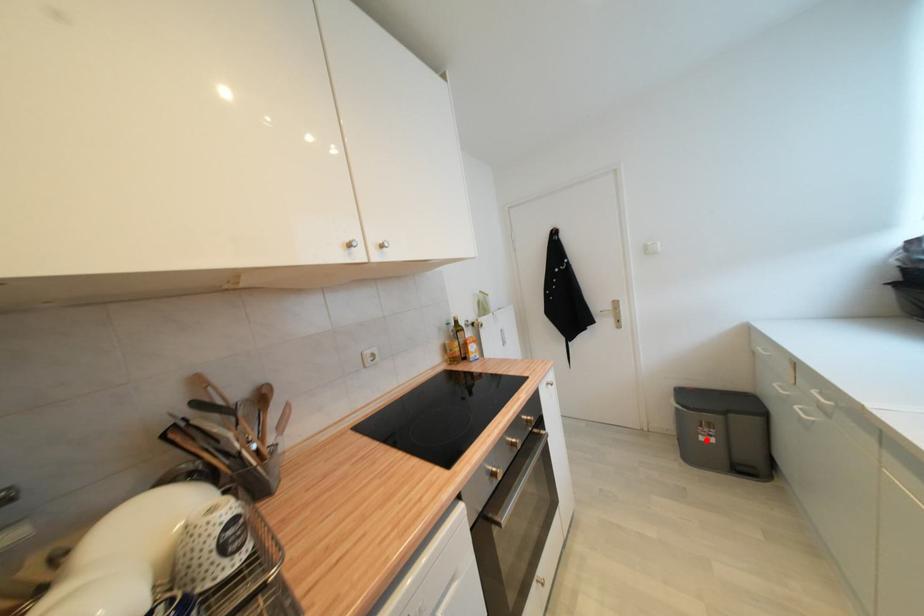
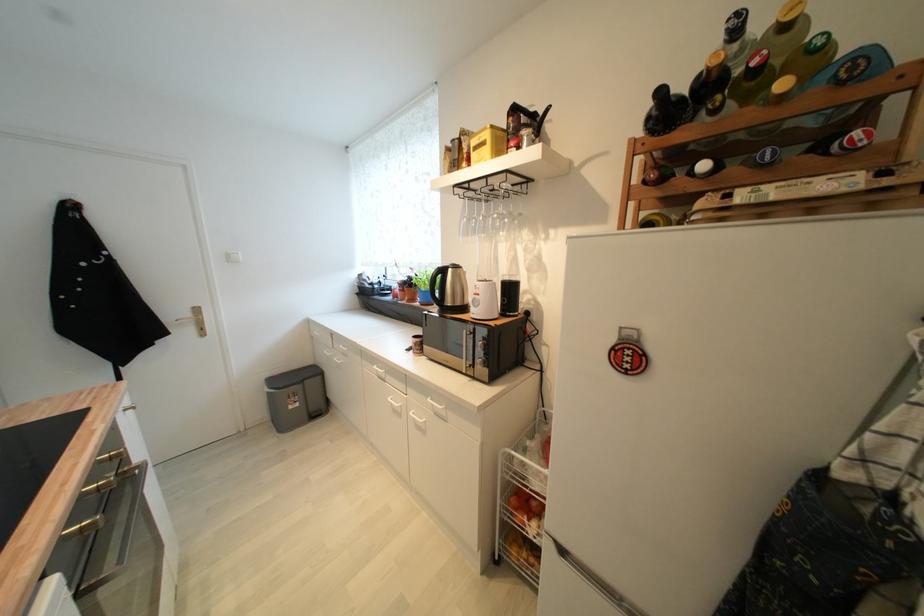
Question: I am providing you with two images of the same scene from different viewpoints. Image1 has a red point marked. In image2, the corresponding 3D location appears at what relative position? Reply with the corresponding letter.

Choices:
 (A) Closer
 (B) Farther

Answer: (A)